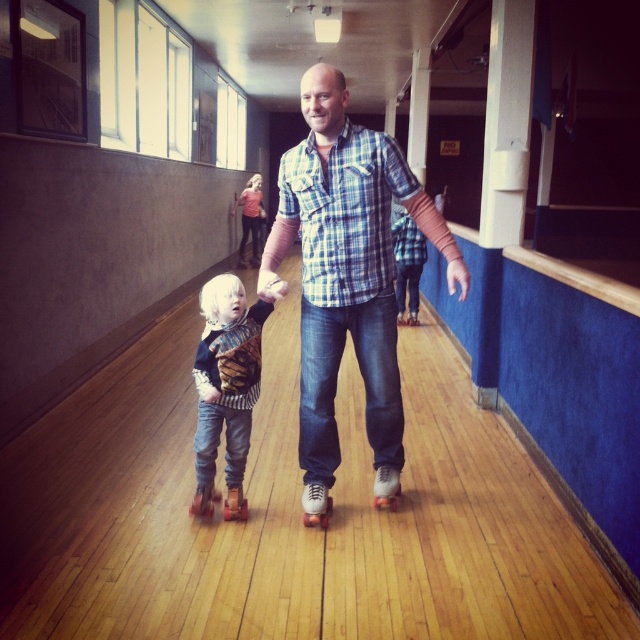
Which is behind, point (365, 419) or point (374, 481)?

Point (374, 481)

Which is in front, point (310, 416) or point (388, 474)?

Point (310, 416) is in front.

This screenshot has height=640, width=640. What are the coordinates of `blue plaid shirt at center` in the screenshot? It's located at (346, 268).

Does point (348, 205) come in front of point (314, 486)?

Yes, point (348, 205) is in front of point (314, 486).

Is blue plaid shirt at center to the left of white rubber roller skate at center from the viewer's perspective?

No, blue plaid shirt at center is not to the left of white rubber roller skate at center.

At what (x,y) coordinates should I click in order to perform the action: click on blue plaid shirt at center. Please return your answer as a coordinate pair (x, y). The image size is (640, 640). Looking at the image, I should click on (346, 268).

Locate an element on the screen. The image size is (640, 640). blue plaid shirt at center is located at coordinates (346, 268).

Is white matte roller skate at center positioned before orange matte roller skate at lower left?

No, white matte roller skate at center is behind orange matte roller skate at lower left.

Between point (392, 483) and point (209, 486), which one is positioned behind?

The point (392, 483) is more distant.

At what (x,y) coordinates should I click in order to perform the action: click on white matte roller skate at center. Please return your answer as a coordinate pair (x, y). This screenshot has width=640, height=640. Looking at the image, I should click on (387, 486).